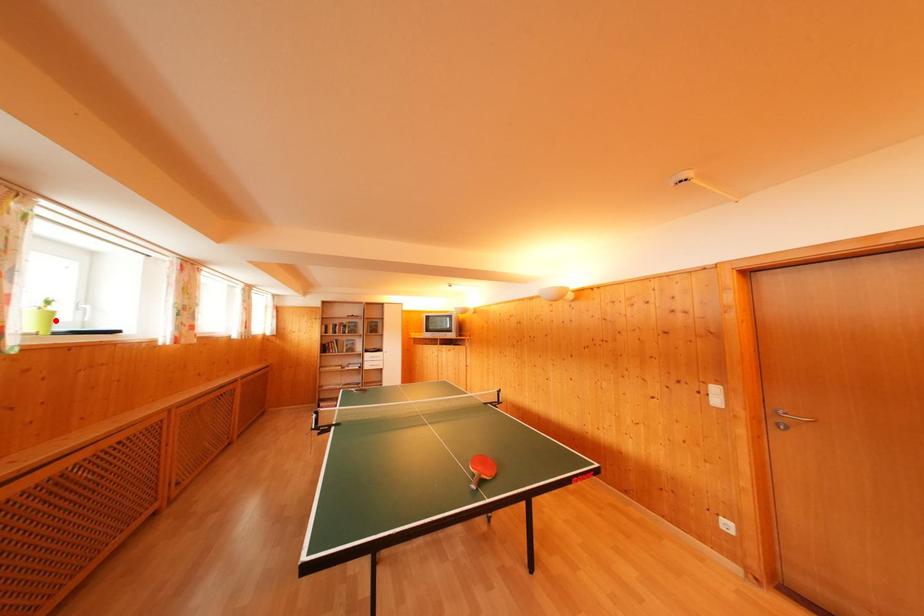
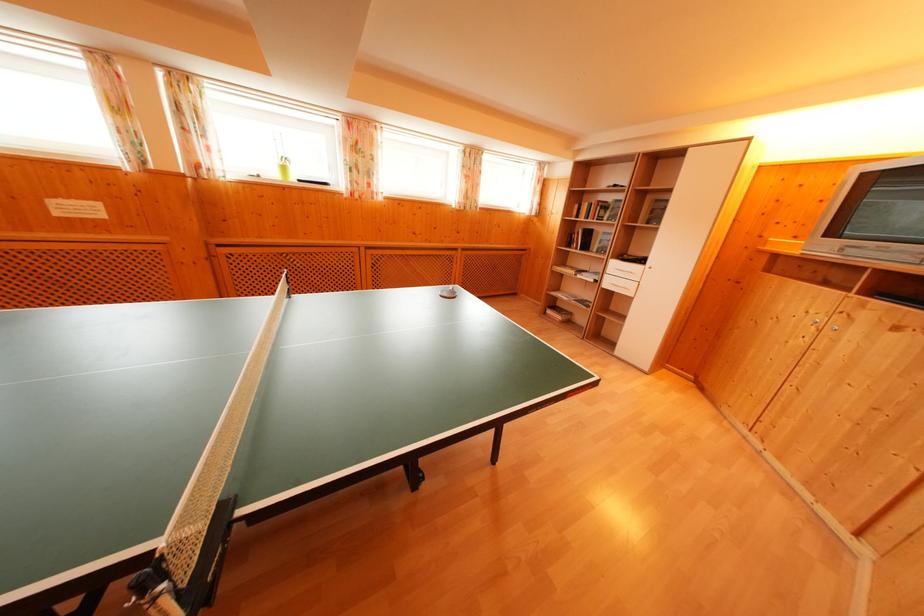
Where in the second image is the point corresponding to the highlighted location from the first image?

(288, 174)